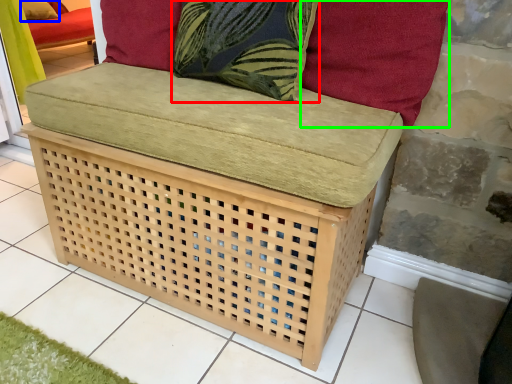
Question: Based on their relative distances, which object is farther from throw pillow (highlighted by a red box)? Choose from pillow (highlighted by a blue box) and pillow (highlighted by a green box).

Choices:
 (A) pillow
 (B) pillow

Answer: (A)